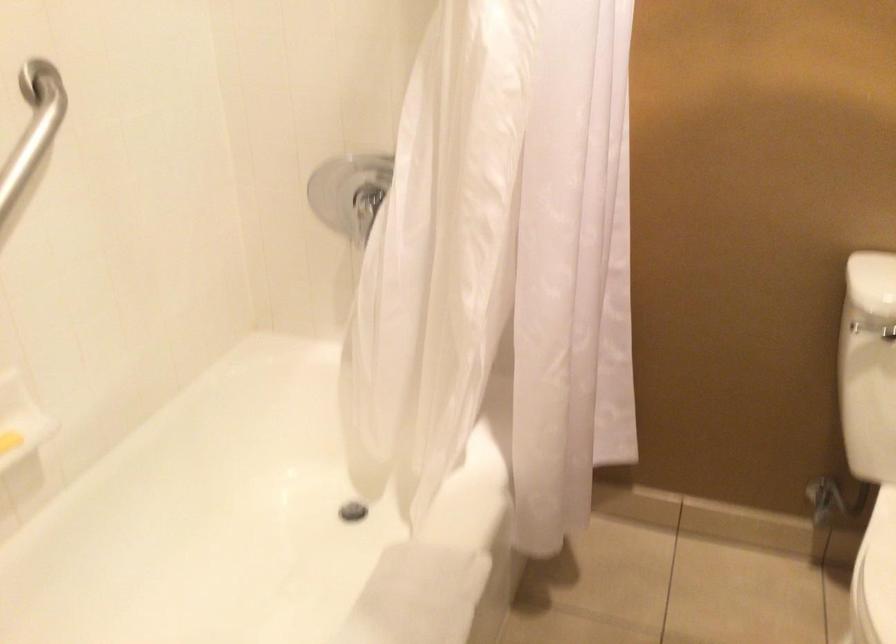
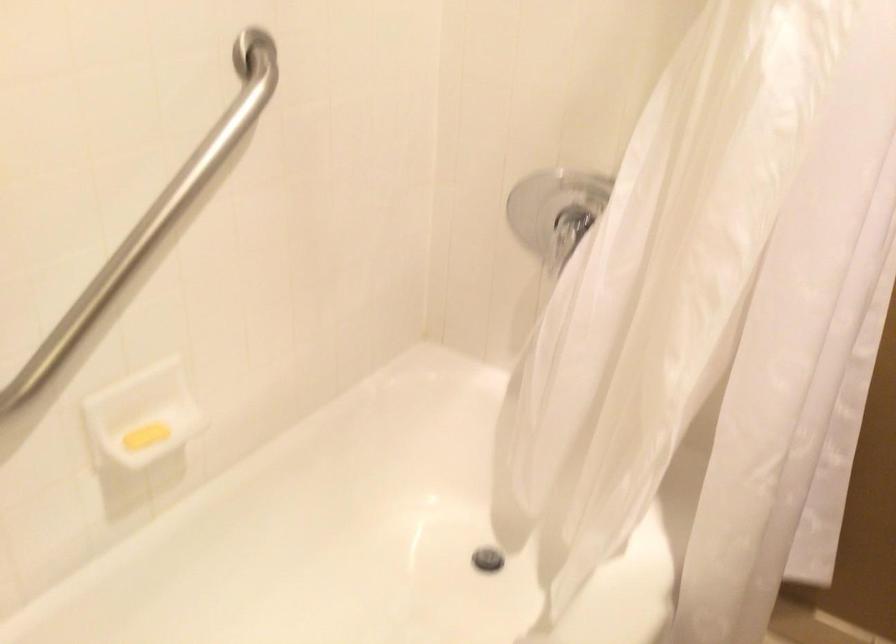
Question: Based on the continuous images, in which direction is the camera rotating? Reply with the corresponding letter.

Choices:
 (A) Left
 (B) Right
 (C) Up
 (D) Down

Answer: (A)